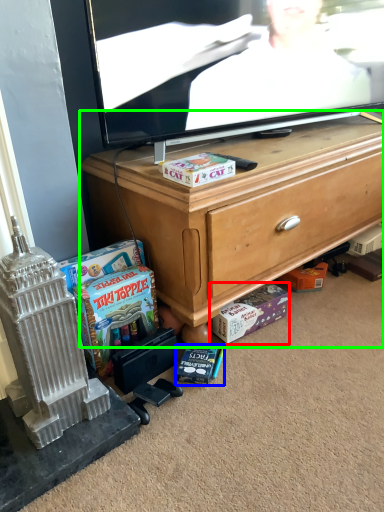
Question: Estimate the real-world distances between objects in this image. Which object is farther from cash (highlighted by a red box), book (highlighted by a blue box) or cabinetry (highlighted by a green box)?

Choices:
 (A) book
 (B) cabinetry

Answer: (B)